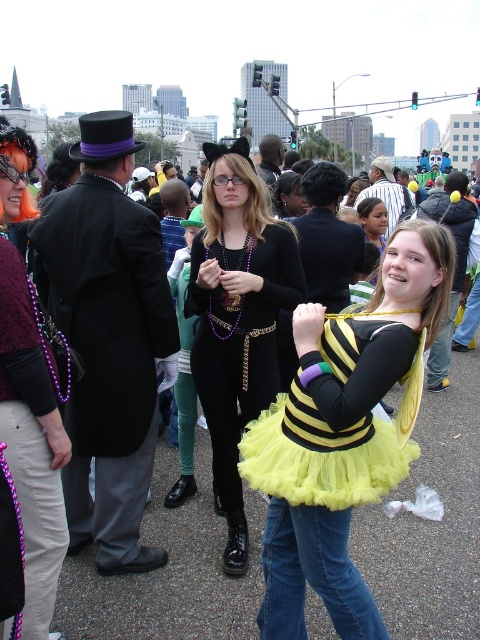
Question: Which point is farther to the camera?

Choices:
 (A) yellow tulle skirt at center
 (B) black matte tutu at center
 (C) matte black dress at center

Answer: (B)

Question: Can you confirm if yellow tulle skirt at center is thinner than yellow tulle dress at center?

Choices:
 (A) no
 (B) yes

Answer: (A)

Question: Is yellow tulle dress at center to the left of matte black dress at center from the viewer's perspective?

Choices:
 (A) yes
 (B) no

Answer: (B)

Question: Which object is closer to the camera taking this photo?

Choices:
 (A) black matte tutu at center
 (B) matte black dress at center

Answer: (B)

Question: Which object is farther from the camera taking this photo?

Choices:
 (A) yellow tulle skirt at center
 (B) matte black dress at center
 (C) yellow tulle dress at center
 (D) black matte tutu at center

Answer: (D)

Question: Does yellow tulle dress at center appear on the left side of matte black dress at center?

Choices:
 (A) yes
 (B) no

Answer: (B)